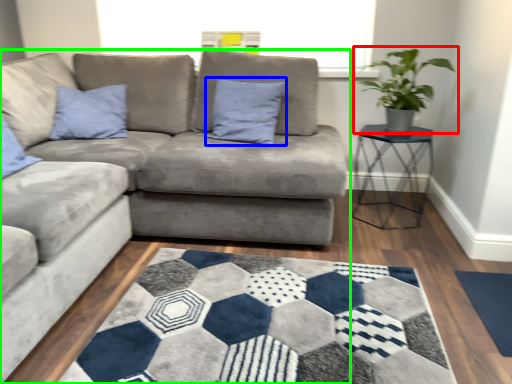
Question: Which object is the closest to the houseplant (highlighted by a red box)? Choose among these: pillow (highlighted by a blue box) or studio couch (highlighted by a green box).

Choices:
 (A) pillow
 (B) studio couch

Answer: (A)